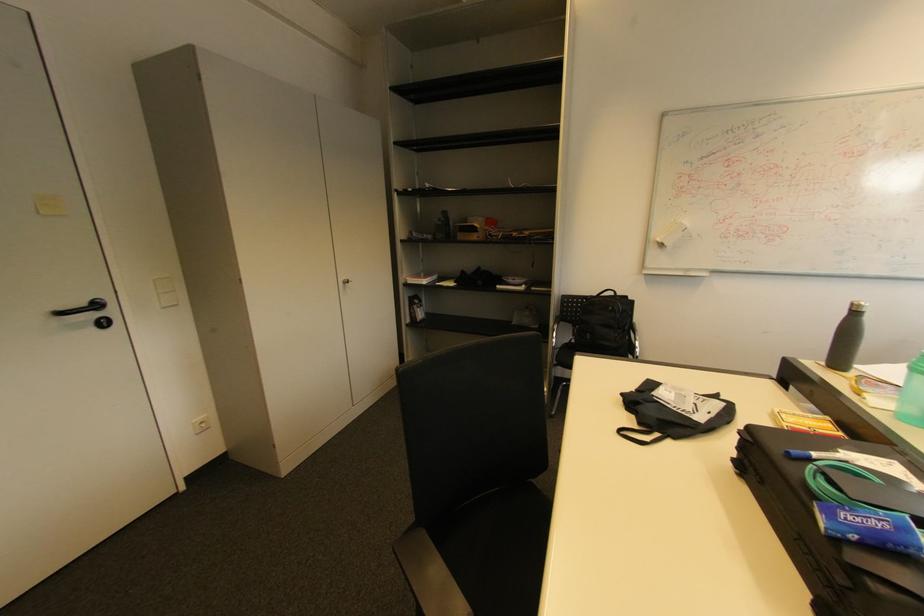
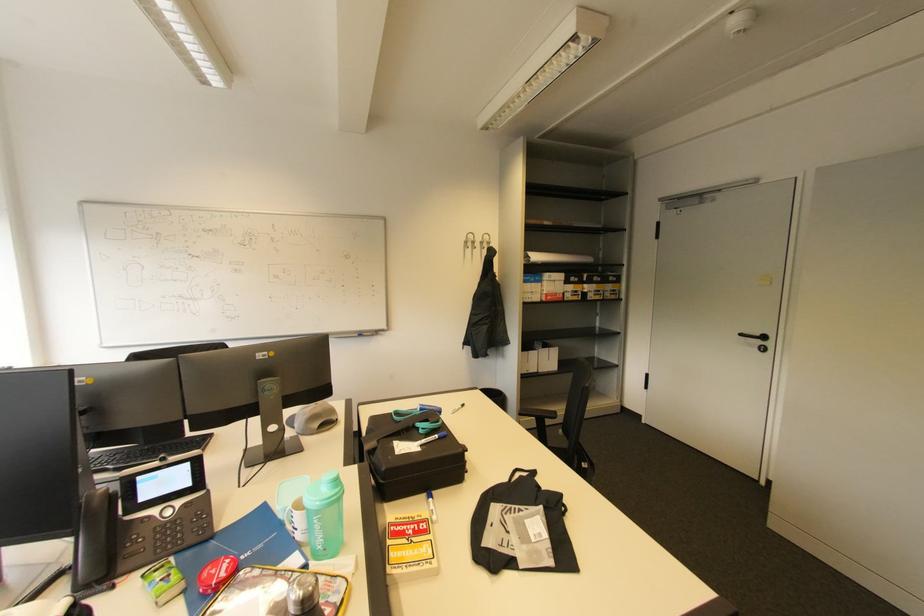
The point at (103, 305) is marked in the first image. Where is the corresponding point in the second image?

(769, 339)